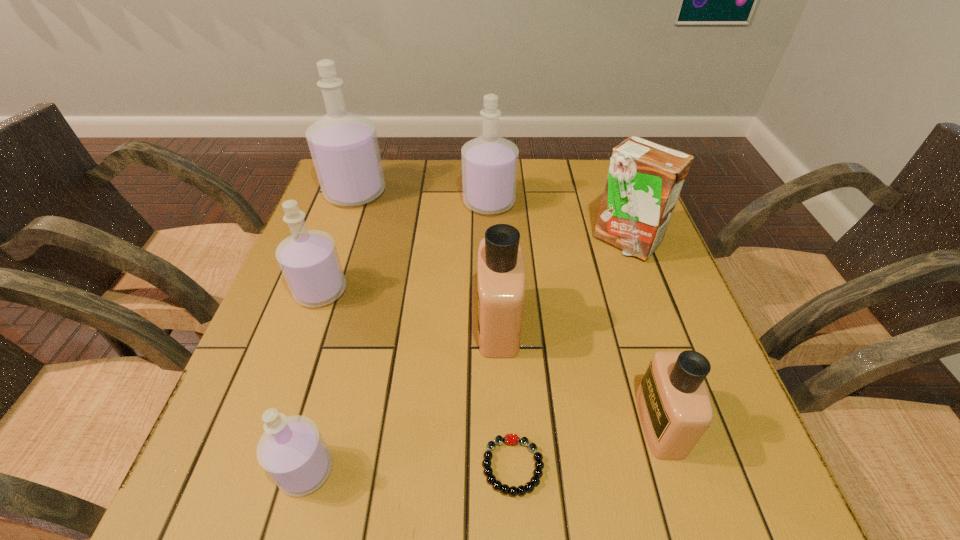
The width and height of the screenshot is (960, 540). I want to click on the nearest purple perfume, so click(292, 451).

Identify the location of the shortest object. This screenshot has height=540, width=960. (512, 439).

Locate an element on the screen. The width and height of the screenshot is (960, 540). black bracelet is located at coordinates (512, 439).

The width and height of the screenshot is (960, 540). In order to click on vacant space situated 0.080m on the right of the tallest object in this screenshot , I will do `click(414, 193)`.

Find the location of `free spot located on the right of the second tallest perfume`. free spot located on the right of the second tallest perfume is located at coordinates (638, 202).

You are a GUI agent. You are given a task and a screenshot of the screen. Output one action in this format:
    pyautogui.click(x=<x>, y=<y>)
    Task: Click on the blank area located 0.380m on the straw side of the carton
    This screenshot has height=540, width=960.
    Given the screenshot: What is the action you would take?
    pyautogui.click(x=685, y=411)

Locate an element on the screen. This screenshot has width=960, height=540. blank space located on the back of the third biggest purple perfume is located at coordinates (358, 184).

The height and width of the screenshot is (540, 960). Find the location of `free space located 0.050m on the front label of the left beige perfume`. free space located 0.050m on the front label of the left beige perfume is located at coordinates (453, 323).

Locate an element on the screen. Image resolution: width=960 pixels, height=540 pixels. free region located on the front label of the left beige perfume is located at coordinates (381, 323).

Locate an element on the screen. The image size is (960, 540). vacant area located on the front label of the left beige perfume is located at coordinates (386, 323).